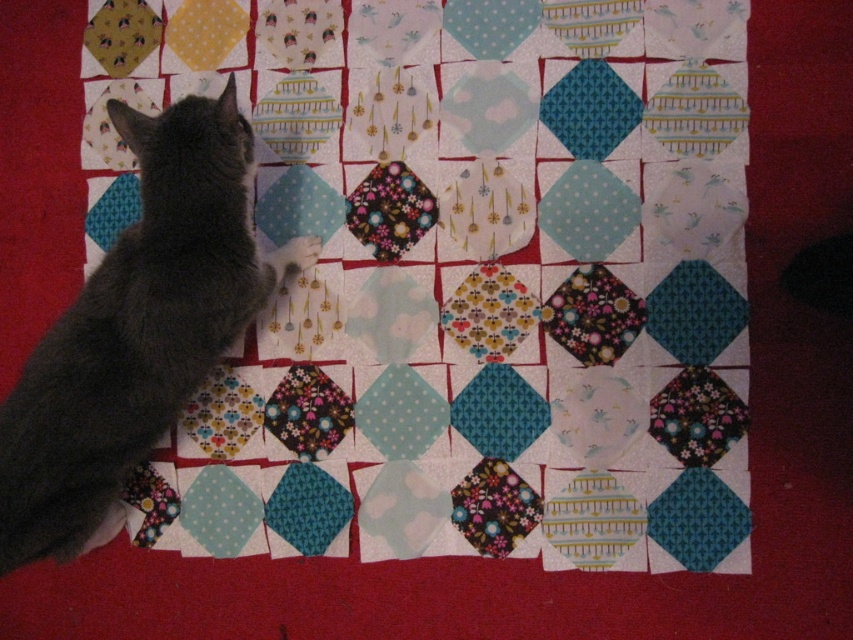
Question: Which of the following is the farthest from the observer?

Choices:
 (A) dark gray fur cat at left
 (B) fluffy gray paw at center

Answer: (B)

Question: Among these objects, which one is nearest to the camera?

Choices:
 (A) fluffy gray paw at center
 (B) dark gray fur cat at left

Answer: (B)

Question: Is dark gray fur cat at left to the left of fluffy gray paw at center from the viewer's perspective?

Choices:
 (A) no
 (B) yes

Answer: (B)

Question: Is dark gray fur cat at left above fluffy gray paw at center?

Choices:
 (A) yes
 (B) no

Answer: (B)

Question: Which of the following is the closest to the observer?

Choices:
 (A) (309, 257)
 (B) (213, 355)

Answer: (B)

Question: Where is dark gray fur cat at left located in relation to fluffy gray paw at center in the image?

Choices:
 (A) below
 (B) above

Answer: (A)